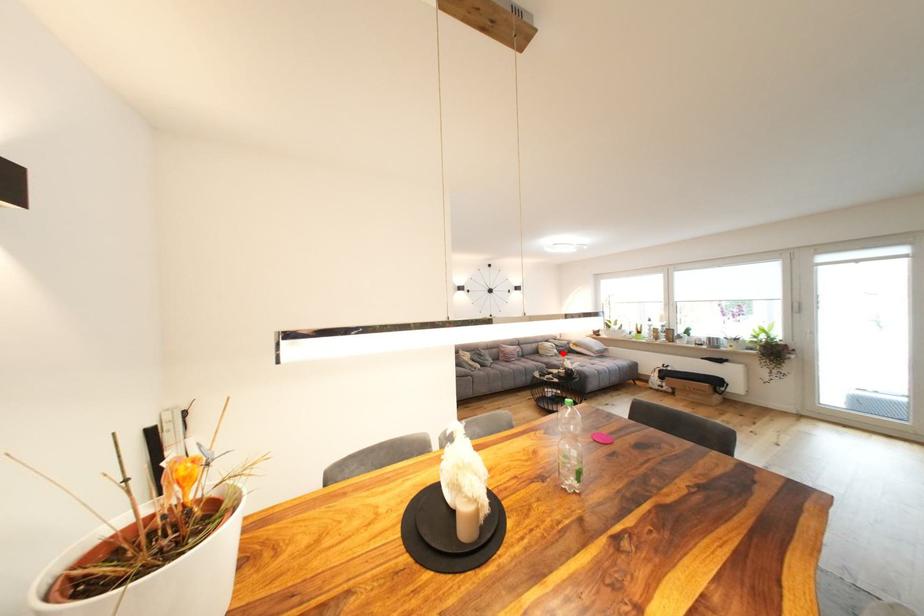
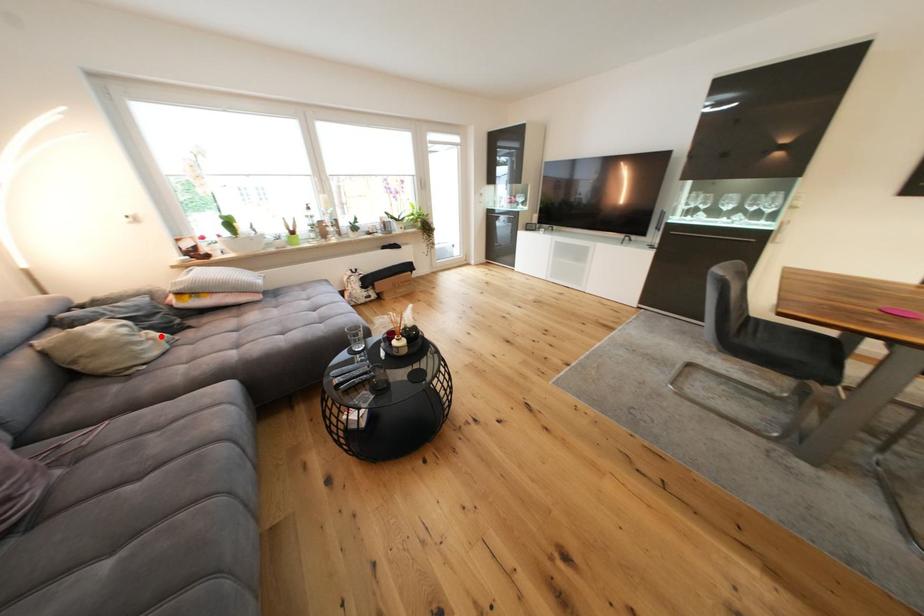
I am providing you with two images of the same scene from different viewpoints. A red point is marked on the first image and another point is marked on the second image. Does the point marked in image1 correspond to the same location as the one in image2?

Yes